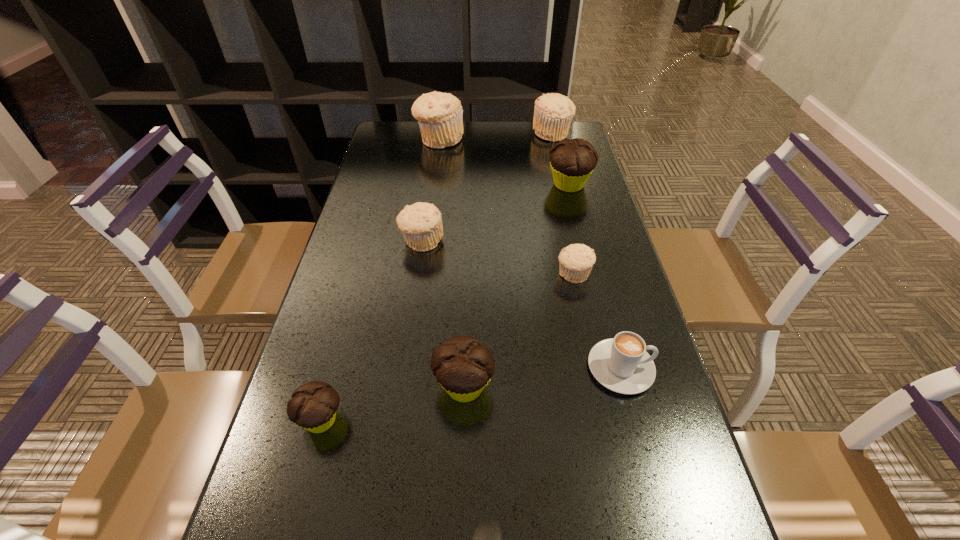
Select which beige muffin appears as the closest to the tallest muffin. Please provide its 2D coordinates. Your answer should be formatted as a tuple, i.e. [(x, y)], where the tuple contains the x and y coordinates of a point satisfying the conditions above.

[(553, 113)]

Locate which chocolate muffin ranks in proximity to the leftmost object. Please provide its 2D coordinates. Your answer should be formatted as a tuple, i.e. [(x, y)], where the tuple contains the x and y coordinates of a point satisfying the conditions above.

[(463, 366)]

Locate which chocolate muffin is the closest to the seventh nearest object. Please provide its 2D coordinates. Your answer should be formatted as a tuple, i.e. [(x, y)], where the tuple contains the x and y coordinates of a point satisfying the conditions above.

[(463, 366)]

You are a GUI agent. You are given a task and a screenshot of the screen. Output one action in this format:
    pyautogui.click(x=<x>, y=<y>)
    Task: Click on the free spot that satisfies the following two spatial constraints: 1. on the front side of the tallest muffin; 2. on the right side of the third farthest muffin
    
    Given the screenshot: What is the action you would take?
    pyautogui.click(x=433, y=185)

Find the location of a particular element. The width and height of the screenshot is (960, 540). free location that satisfies the following two spatial constraints: 1. on the back side of the second biggest beige muffin; 2. on the right side of the leftmost object is located at coordinates (399, 133).

At what (x,y) coordinates should I click in order to perform the action: click on vacant area in the image that satisfies the following two spatial constraints: 1. on the front side of the sixth nearest object; 2. on the right side of the second biggest chocolate muffin. Please return your answer as a coordinate pair (x, y). Looking at the image, I should click on coord(400,386).